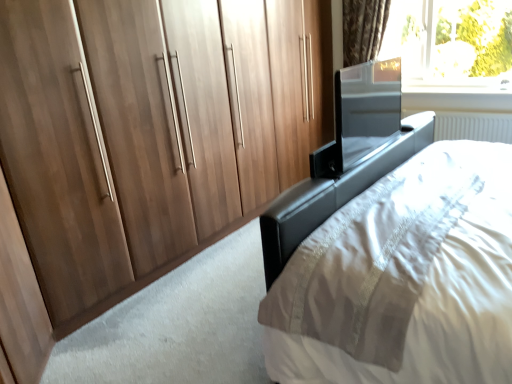
Measure the distance between black leather bed at center and camera.

black leather bed at center is 3.56 feet away from camera.

Describe the element at coordinates (366, 110) in the screenshot. I see `glossy metallic screen door at upper right` at that location.

This screenshot has height=384, width=512. I want to click on transparent glass window at upper right, so click(x=451, y=42).

Is glossy metallic screen door at upper right located outside black leather bed at center?

Absolutely, glossy metallic screen door at upper right is external to black leather bed at center.

Which is in front, point (364, 65) or point (357, 251)?

The point (357, 251) is closer to the camera.

In the image, is glossy metallic screen door at upper right on the left side or the right side of black leather bed at center?

Based on their positions, glossy metallic screen door at upper right is located to the left of black leather bed at center.

Could glossy metallic screen door at upper right be considered to be inside walnut wood wardrobe at left?

No, glossy metallic screen door at upper right is not a part of walnut wood wardrobe at left.

How much distance is there between walnut wood wardrobe at left and glossy metallic screen door at upper right?

walnut wood wardrobe at left and glossy metallic screen door at upper right are 1.15 meters apart.

From the picture: Can you confirm if walnut wood wardrobe at left is bigger than glossy metallic screen door at upper right?

Correct, walnut wood wardrobe at left is larger in size than glossy metallic screen door at upper right.

Is walnut wood wardrobe at left at the right side of glossy metallic screen door at upper right?

In fact, walnut wood wardrobe at left is to the left of glossy metallic screen door at upper right.

From a real-world perspective, is glossy metallic screen door at upper right on transparent glass window at upper right?

Actually, glossy metallic screen door at upper right is physically below transparent glass window at upper right in the real world.

From the image's perspective, which object appears higher, glossy metallic screen door at upper right or transparent glass window at upper right?

transparent glass window at upper right is shown above in the image.

Can you tell me how much glossy metallic screen door at upper right and transparent glass window at upper right differ in facing direction?

The facing directions of glossy metallic screen door at upper right and transparent glass window at upper right are 89.6 degrees apart.

The height and width of the screenshot is (384, 512). I want to click on bed on the right of walnut wood wardrobe at left, so click(x=404, y=279).

Is walnut wood wardrobe at left closer to the viewer compared to black leather bed at center?

No, it is behind black leather bed at center.

Is walnut wood wardrobe at left not within black leather bed at center?

Yes, walnut wood wardrobe at left is not within black leather bed at center.

Is walnut wood wardrobe at left not near black leather bed at center?

Yes, walnut wood wardrobe at left is far from black leather bed at center.

From the image's perspective, relative to walnut wood wardrobe at left, is black leather bed at center above or below?

Clearly, from the image's perspective, black leather bed at center is below walnut wood wardrobe at left.

Could you tell me if black leather bed at center is turned towards walnut wood wardrobe at left?

No, black leather bed at center is not facing towards walnut wood wardrobe at left.

From a real-world perspective, which is physically below, black leather bed at center or walnut wood wardrobe at left?

From a 3D spatial view, black leather bed at center is below.

Is the position of black leather bed at center more distant than that of transparent glass window at upper right?

No, it is in front of transparent glass window at upper right.

From a real-world perspective, is black leather bed at center located beneath transparent glass window at upper right?

Correct, in the physical world, black leather bed at center is lower than transparent glass window at upper right.

In terms of height, does black leather bed at center look taller or shorter compared to transparent glass window at upper right?

In the image, black leather bed at center appears to be shorter than transparent glass window at upper right.

Consider the image. From the image's perspective, is black leather bed at center above transparent glass window at upper right?

No, from the image's perspective, black leather bed at center is not above transparent glass window at upper right.

From a real-world perspective, is walnut wood wardrobe at left positioned above or below transparent glass window at upper right?

In terms of real-world spatial position, walnut wood wardrobe at left is below transparent glass window at upper right.

Is walnut wood wardrobe at left oriented away from transparent glass window at upper right?

walnut wood wardrobe at left does not have its back to transparent glass window at upper right.

Is walnut wood wardrobe at left smaller than transparent glass window at upper right?

Actually, walnut wood wardrobe at left might be larger than transparent glass window at upper right.

Is walnut wood wardrobe at left touching transparent glass window at upper right?

walnut wood wardrobe at left and transparent glass window at upper right are not in contact.

Locate an element on the screen. The image size is (512, 384). screen door on the left of black leather bed at center is located at coordinates (366, 110).

Find the location of a particular element. cupboard below the glossy metallic screen door at upper right (from a real-world perspective) is located at coordinates (151, 131).

From the image, which object appears to be farther from black leather bed at center, transparent glass window at upper right or walnut wood wardrobe at left?

Based on the image, transparent glass window at upper right appears to be further to black leather bed at center.

Looking at the image, which one is located further to black leather bed at center, walnut wood wardrobe at left or transparent glass window at upper right?

The object further to black leather bed at center is transparent glass window at upper right.

From the image, which object appears to be nearer to glossy metallic screen door at upper right, transparent glass window at upper right or walnut wood wardrobe at left?

Among the two, walnut wood wardrobe at left is located nearer to glossy metallic screen door at upper right.

Which object lies further to the anchor point black leather bed at center, transparent glass window at upper right or glossy metallic screen door at upper right?

transparent glass window at upper right lies further to black leather bed at center than the other object.

Looking at the image, which one is located further to walnut wood wardrobe at left, glossy metallic screen door at upper right or black leather bed at center?

black leather bed at center.

From the image, which object appears to be nearer to transparent glass window at upper right, glossy metallic screen door at upper right or black leather bed at center?

The object closer to transparent glass window at upper right is glossy metallic screen door at upper right.

Estimate the real-world distances between objects in this image. Which object is closer to glossy metallic screen door at upper right, black leather bed at center or walnut wood wardrobe at left?

The object closer to glossy metallic screen door at upper right is black leather bed at center.

Looking at this image, which object lies nearer to the anchor point walnut wood wardrobe at left, transparent glass window at upper right or glossy metallic screen door at upper right?

glossy metallic screen door at upper right is positioned closer to the anchor walnut wood wardrobe at left.

You are a GUI agent. You are given a task and a screenshot of the screen. Output one action in this format:
    pyautogui.click(x=<x>, y=<y>)
    Task: Click on the cupboard located between black leather bed at center and transparent glass window at upper right in the depth direction
    The image size is (512, 384).
    Given the screenshot: What is the action you would take?
    pyautogui.click(x=151, y=131)

You are a GUI agent. You are given a task and a screenshot of the screen. Output one action in this format:
    pyautogui.click(x=<x>, y=<y>)
    Task: Click on the screen door between walnut wood wardrobe at left and black leather bed at center in the horizontal direction
    
    Given the screenshot: What is the action you would take?
    pyautogui.click(x=366, y=110)

Identify the location of screen door located between black leather bed at center and transparent glass window at upper right in the depth direction. (366, 110).

Find the location of a particular element. screen door between walnut wood wardrobe at left and transparent glass window at upper right from front to back is located at coordinates (366, 110).